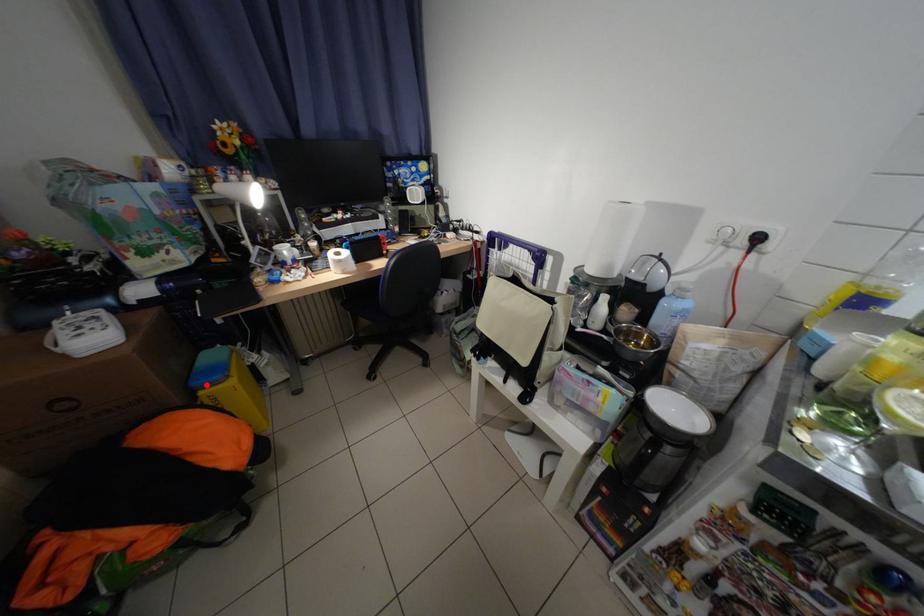
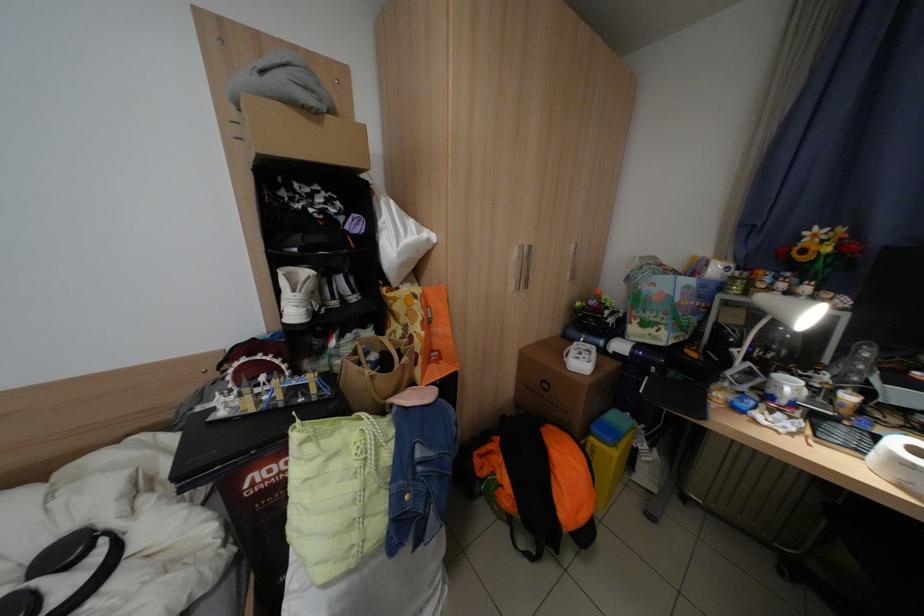
Where in the second image is the point corresponding to the highlighted location from the first image?

(604, 430)